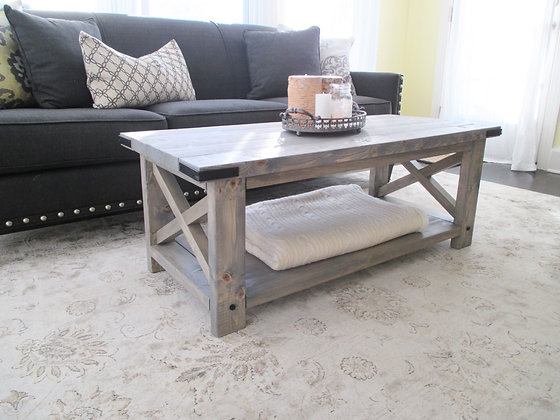
Image resolution: width=560 pixels, height=420 pixels. I want to click on blanket/throw, so click(328, 230).